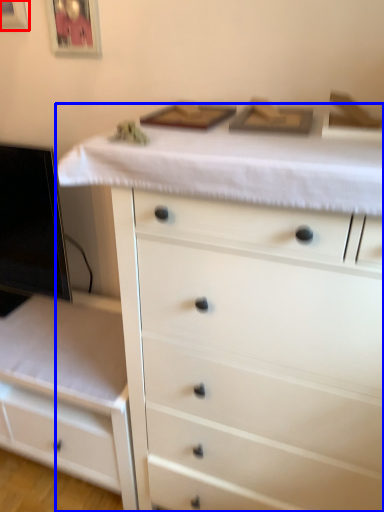
Question: Among these objects, which one is nearest to the camera, picture frame (highlighted by a red box) or chest of drawers (highlighted by a blue box)?

Choices:
 (A) picture frame
 (B) chest of drawers

Answer: (B)